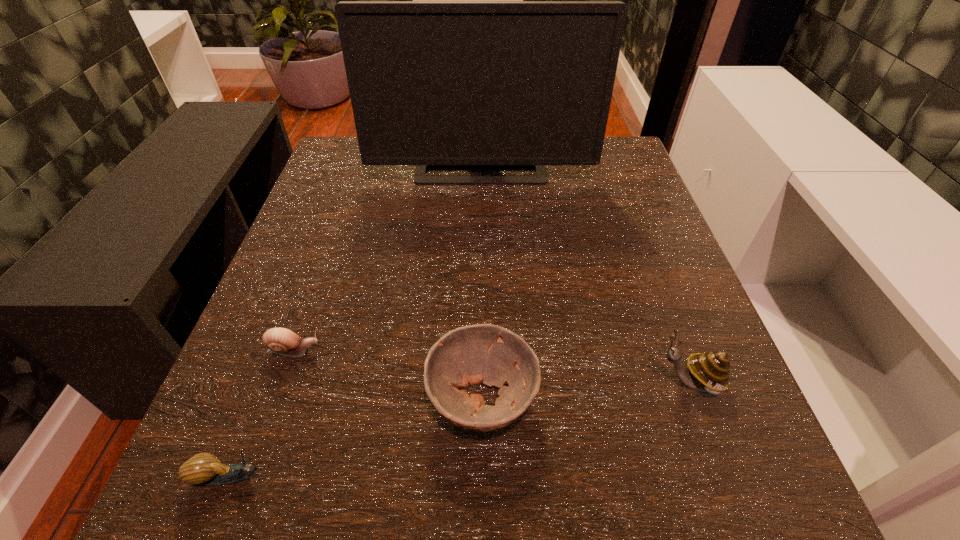
The height and width of the screenshot is (540, 960). I want to click on object that can be found as the closest to the bowl, so click(x=710, y=371).

Identify which object is located as the third nearest to the farthest object. Please provide its 2D coordinates. Your answer should be formatted as a tuple, i.e. [(x, y)], where the tuple contains the x and y coordinates of a point satisfying the conditions above.

[(710, 371)]

At what (x,y) coordinates should I click in order to perform the action: click on the second closest escargot to the tallest object. Please return your answer as a coordinate pair (x, y). The width and height of the screenshot is (960, 540). Looking at the image, I should click on (710, 371).

Identify the location of escargot that stands as the closest to the farthest escargot. (204, 468).

Find the location of `blank area in the image that satisfies the following two spatial constraints: 1. on the screen side of the third tallest object; 2. on the left side of the computer monitor`. blank area in the image that satisfies the following two spatial constraints: 1. on the screen side of the third tallest object; 2. on the left side of the computer monitor is located at coordinates (481, 399).

Where is `free location that satisfies the following two spatial constraints: 1. on the front-facing side of the third tallest object; 2. on the left side of the farthest escargot`? free location that satisfies the following two spatial constraints: 1. on the front-facing side of the third tallest object; 2. on the left side of the farthest escargot is located at coordinates (277, 399).

Locate an element on the screen. This screenshot has height=540, width=960. free space that satisfies the following two spatial constraints: 1. on the front-facing side of the farthest escargot; 2. on the back side of the third shortest object is located at coordinates (277, 399).

Identify the location of free space that satisfies the following two spatial constraints: 1. on the screen side of the third tallest object; 2. on the right side of the tallest object. (481, 399).

You are a GUI agent. You are given a task and a screenshot of the screen. Output one action in this format:
    pyautogui.click(x=<x>, y=<y>)
    Task: Click on the free space that satisfies the following two spatial constraints: 1. on the screen side of the third shortest object; 2. on the left side of the tallest object
    Image resolution: width=960 pixels, height=540 pixels.
    Given the screenshot: What is the action you would take?
    pyautogui.click(x=481, y=399)